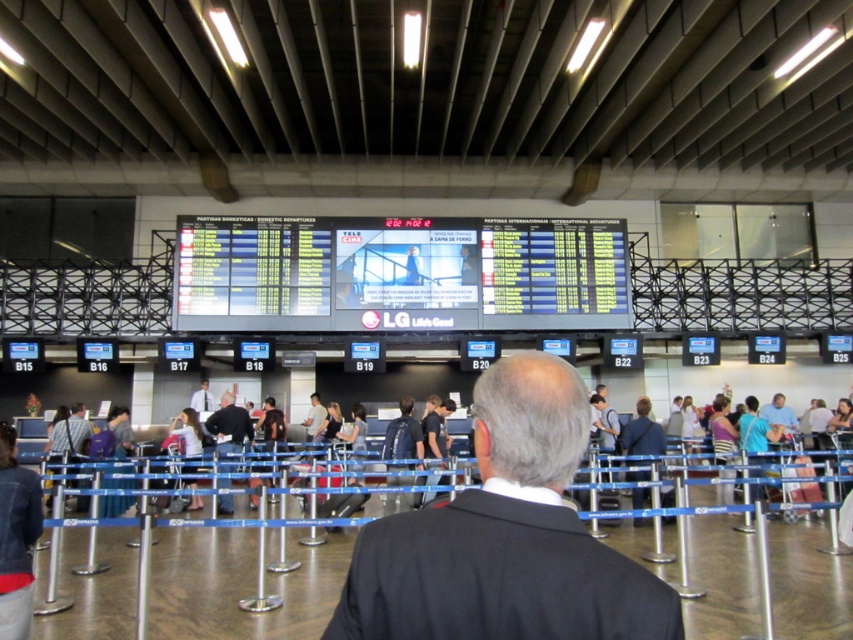
Is black smooth shirt at center below light brown leather jacket at center?

No, black smooth shirt at center is not below light brown leather jacket at center.

Is point (210, 413) positioned behind point (317, 433)?

Yes.

Locate an element on the screen. black smooth shirt at center is located at coordinates (229, 429).

Does black suit coat at center appear on the right side of black smooth shirt at center?

Yes, black suit coat at center is to the right of black smooth shirt at center.

Can you confirm if black suit coat at center is smaller than black smooth shirt at center?

Yes.

The image size is (853, 640). What are the coordinates of `black suit coat at center` in the screenshot? It's located at (505, 536).

Is black suit coat at center bigger than striped shirt at left?

No, black suit coat at center is not bigger than striped shirt at left.

Does black suit coat at center appear over striped shirt at left?

Correct, black suit coat at center is located above striped shirt at left.

This screenshot has width=853, height=640. I want to click on black suit coat at center, so click(505, 536).

This screenshot has height=640, width=853. I want to click on black suit coat at center, so click(505, 536).